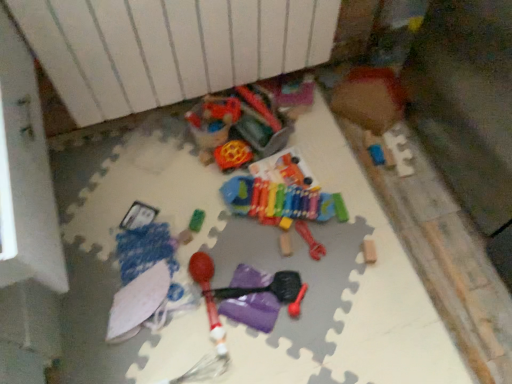
Question: Considering the positions of white matte umbrella at lower left, arranged as the second toy when ordered from the bottom, and multicolored plastic xylophone at center, placed as the third toy when sorted from top to bottom, in the image, is white matte umbrella at lower left, arranged as the second toy when ordered from the bottom, bigger or smaller than multicolored plastic xylophone at center, placed as the third toy when sorted from top to bottom,?

Choices:
 (A) big
 (B) small

Answer: (B)

Question: Considering their positions, is white matte umbrella at lower left, arranged as the second toy when ordered from the bottom, located in front of or behind multicolored plastic xylophone at center, which is the 7th toy in bottom-to-top order?

Choices:
 (A) front
 (B) behind

Answer: (A)

Question: Which object is the closest to the rubber chew toy at center, acting as the 5th toy starting from the bottom?

Choices:
 (A) multicolored plastic xylophone at center, which is the 7th toy in bottom-to-top order
 (B) wooden puzzle piece at upper right, the ninth toy from the bottom
 (C) purple plastic hammer at center, which appears as the 1th toy when ordered from the bottom
 (D) green rubber toy at center, positioned as the 6th toy in bottom-to-top order
 (E) rubber/maraca at center, positioned as the seventh toy in top-to-bottom order

Answer: (A)

Question: Estimate the real-world distances between objects in this image. Which object is closer to the purple plastic hammer at center, the 9th toy when ordered from top to bottom?

Choices:
 (A) green rubber toy at center, which is the 4th toy from top to bottom
 (B) white matte umbrella at lower left, arranged as the second toy when ordered from the bottom
 (C) rubberized plastic ball at center, the eighth toy positioned from the bottom
 (D) wooden block at center, the 4th toy when ordered from bottom to top
 (E) multicolored plastic xylophone at center, placed as the third toy when sorted from top to bottom

Answer: (D)